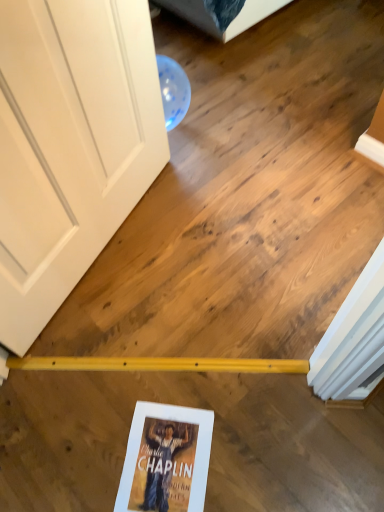
Question: Is point (99, 130) positioned closer to the camera than point (170, 509)?

Choices:
 (A) closer
 (B) farther

Answer: (B)

Question: In terms of width, does white matte door at upper left look wider or thinner when compared to hardcover book at lower center?

Choices:
 (A) thin
 (B) wide

Answer: (A)

Question: Considering the positions of white matte door at upper left and hardcover book at lower center in the image, is white matte door at upper left taller or shorter than hardcover book at lower center?

Choices:
 (A) tall
 (B) short

Answer: (A)

Question: Considering the positions of hardcover book at lower center and white matte door at upper left in the image, is hardcover book at lower center wider or thinner than white matte door at upper left?

Choices:
 (A) thin
 (B) wide

Answer: (B)

Question: From a real-world perspective, relative to white matte door at upper left, is hardcover book at lower center vertically above or below?

Choices:
 (A) above
 (B) below

Answer: (B)

Question: Looking at the image, does hardcover book at lower center seem bigger or smaller compared to white matte door at upper left?

Choices:
 (A) small
 (B) big

Answer: (A)

Question: In terms of height, does hardcover book at lower center look taller or shorter compared to white matte door at upper left?

Choices:
 (A) tall
 (B) short

Answer: (B)